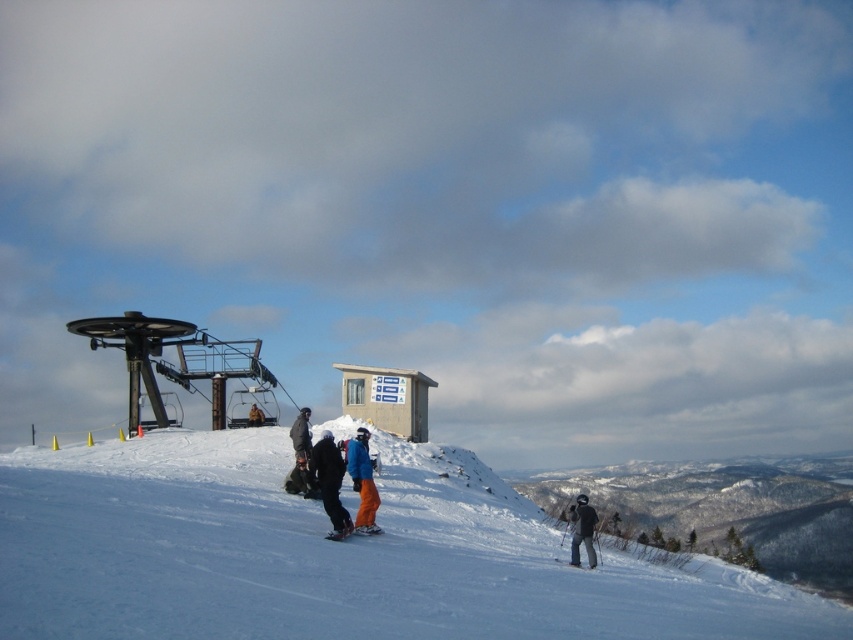
Question: Which of the following is the closest to the observer?

Choices:
 (A) (331, 531)
 (B) (131, 397)
 (C) (590, 556)

Answer: (A)

Question: Does white powdery snow at center appear over blue snowboarder at center?

Choices:
 (A) no
 (B) yes

Answer: (A)

Question: Does blue snowboarder at center appear under dark gray jacket at center?

Choices:
 (A) no
 (B) yes

Answer: (A)

Question: Which of the following is the farthest from the observer?

Choices:
 (A) blue snow pants at center
 (B) orange matte ski at center
 (C) orange matte ski at lower center

Answer: (B)

Question: Is the position of blue snowboarder at center more distant than that of black woolen hat at lower right?

Choices:
 (A) yes
 (B) no

Answer: (B)

Question: Which object appears closest to the camera in this image?

Choices:
 (A) dark gray jacket at center
 (B) blue snow pants at center
 (C) white powdery snow at center
 (D) black woolen hat at lower right

Answer: (C)